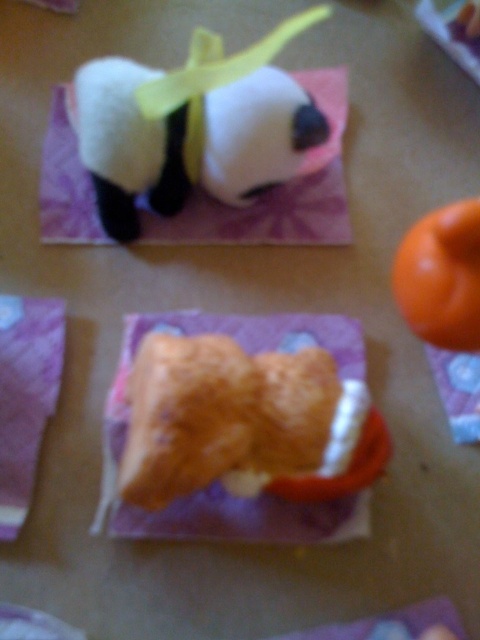
Question: In this image, where is white plush panda at upper left located relative to orange matte ball at upper right?

Choices:
 (A) above
 (B) below

Answer: (A)

Question: Which of the following is the closest to the observer?

Choices:
 (A) golden brown bread at center
 (B) orange matte ball at upper right
 (C) white plush panda at upper left

Answer: (B)

Question: Which point is farther to the camera?

Choices:
 (A) orange matte ball at upper right
 (B) golden brown bread at center

Answer: (B)

Question: Estimate the real-world distances between objects in this image. Which object is farther from the golden brown bread at center?

Choices:
 (A) white plush panda at upper left
 (B) orange matte ball at upper right

Answer: (A)

Question: Does golden brown bread at center have a smaller size compared to orange matte ball at upper right?

Choices:
 (A) no
 (B) yes

Answer: (A)

Question: Does golden brown bread at center appear on the left side of orange matte ball at upper right?

Choices:
 (A) yes
 (B) no

Answer: (A)